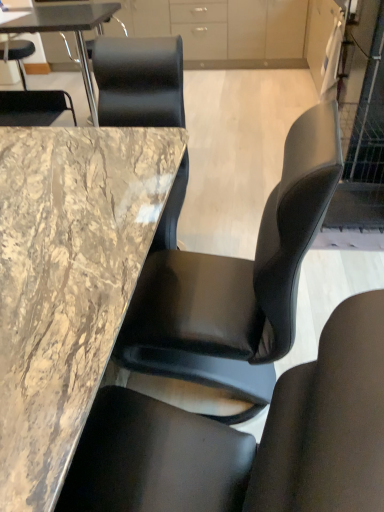
Question: Is matte white cabinet at upper right, the second cabinetry viewed from the top, inside the boundaries of matte white cabinet at upper center, the 1th cabinetry in the back-to-front sequence, or outside?

Choices:
 (A) outside
 (B) inside

Answer: (A)

Question: In terms of height, does matte white cabinet at upper right, which is counted as the 1th cabinetry, starting from the front, look taller or shorter compared to matte white cabinet at upper center, which appears as the second cabinetry when viewed from the right?

Choices:
 (A) short
 (B) tall

Answer: (A)

Question: Estimate the real-world distances between objects in this image. Which object is farther from the marble/black at upper left, the 2th table from the bottom?

Choices:
 (A) black leather chair at center, the first chair in the front-to-back sequence
 (B) matte white cabinet at upper right, marked as the 2th cabinetry in a back-to-front arrangement
 (C) black leather chair at upper left, which is counted as the 2th chair, starting from the bottom
 (D) matte white cabinet at upper center, which is the second cabinetry in bottom-to-top order
 (E) marble table at center, the second table viewed from the top

Answer: (B)

Question: Estimate the real-world distances between objects in this image. Which object is closer to the matte white cabinet at upper right, marked as the 2th cabinetry in a back-to-front arrangement?

Choices:
 (A) black leather chair at upper left, the 2th chair from the right
 (B) matte white cabinet at upper center, which is the second cabinetry in bottom-to-top order
 (C) marble table at center, which appears as the first table when ordered from the bottom
 (D) black leather chair at center, the second chair positioned from the back
 (E) marble/black at upper left, the first table from the top

Answer: (B)